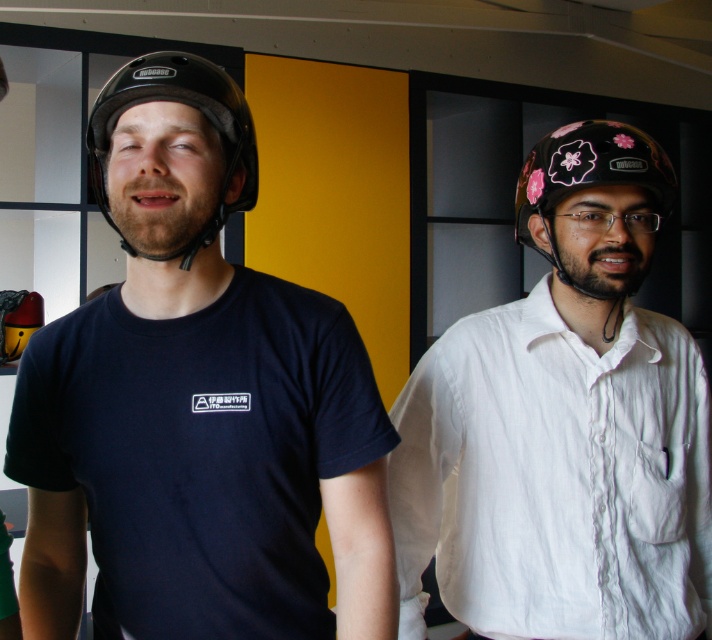
Question: Which of the following is the closest to the observer?

Choices:
 (A) matte black helmet at left
 (B) floral matte helmet at right
 (C) white matte helmet at right
 (D) transparent plastic glasses at center

Answer: (A)

Question: Does white matte helmet at right appear under black matte helmet at left?

Choices:
 (A) no
 (B) yes

Answer: (B)

Question: Which point is closer to the camera?

Choices:
 (A) (604, 333)
 (B) (214, 547)
 (C) (221, 140)
 (D) (602, 140)

Answer: (B)

Question: Is white matte helmet at right to the right of black matte helmet at left from the viewer's perspective?

Choices:
 (A) yes
 (B) no

Answer: (A)

Question: Considering the real-world distances, which object is farthest from the transparent plastic glasses at center?

Choices:
 (A) matte black helmet at left
 (B) white matte helmet at right
 (C) black matte helmet at left
 (D) floral matte helmet at right

Answer: (A)

Question: Does matte black helmet at left appear on the left side of transparent plastic glasses at center?

Choices:
 (A) no
 (B) yes

Answer: (B)